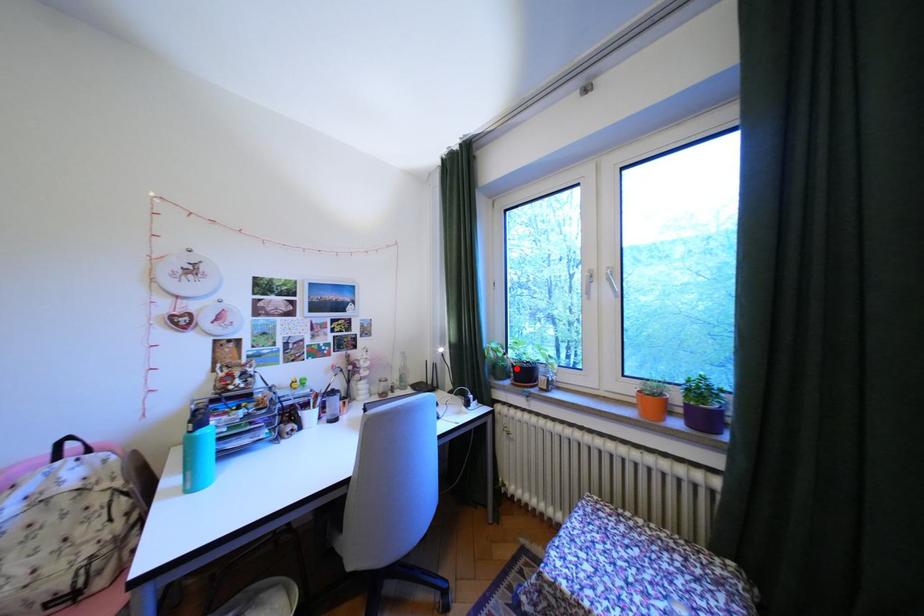
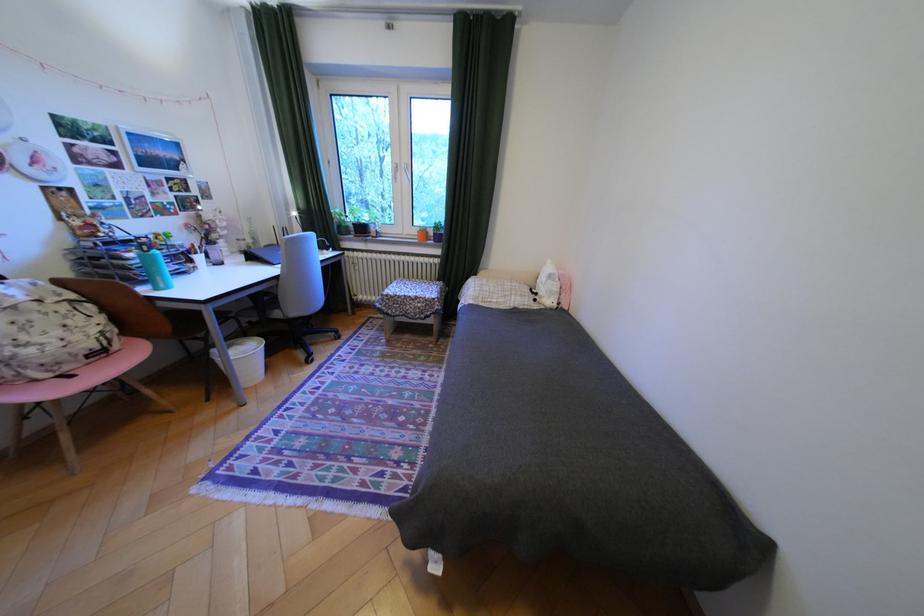
Question: I am providing you with two images of the same scene from different viewpoints. A red point is marked on the first image. At the location where the point appears in image 1, is it still visible in image 2?

Choices:
 (A) Yes
 (B) No

Answer: (A)